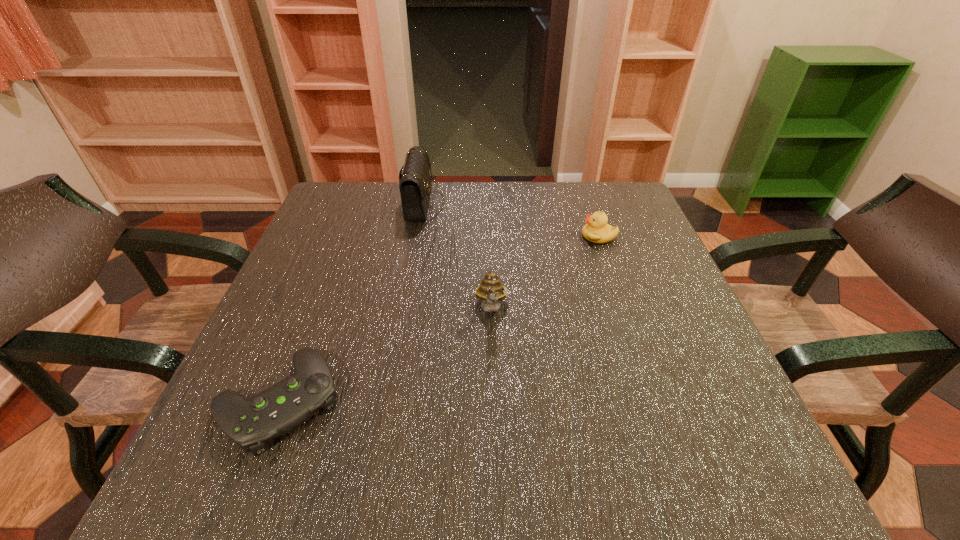
This screenshot has width=960, height=540. I want to click on vacant region located 0.090m on the front-facing side of the second shortest object, so click(x=544, y=236).

Identify the location of free point located on the front-facing side of the second shortest object. (515, 236).

Where is `vacant space located on the front-facing side of the second shortest object`? Image resolution: width=960 pixels, height=540 pixels. vacant space located on the front-facing side of the second shortest object is located at coordinates (552, 236).

Identify the location of vacant space located on the back of the control. (317, 306).

In order to click on clutch bag situated at the far edge in this screenshot , I will do `click(415, 184)`.

I want to click on duckling at the far edge, so click(x=596, y=230).

The image size is (960, 540). In order to click on object that is at the near edge in this screenshot , I will do `click(251, 423)`.

The height and width of the screenshot is (540, 960). In order to click on object at the left edge in this screenshot , I will do `click(251, 423)`.

At what (x,y) coordinates should I click in order to perform the action: click on object at the right edge. Please return your answer as a coordinate pair (x, y). This screenshot has height=540, width=960. Looking at the image, I should click on click(x=596, y=230).

The image size is (960, 540). I want to click on object at the near left corner, so click(x=251, y=423).